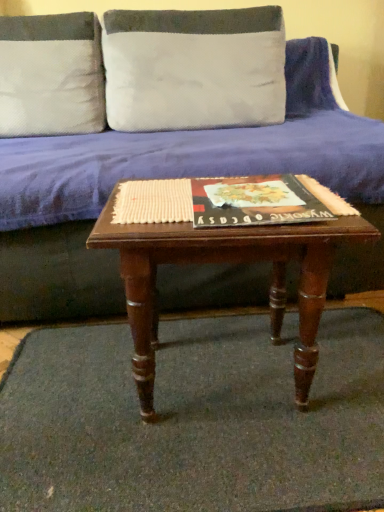
Question: Considering the relative sizes of blue fabric couch at center and mahogany wood coffee table at center in the image provided, is blue fabric couch at center thinner than mahogany wood coffee table at center?

Choices:
 (A) no
 (B) yes

Answer: (A)

Question: Does blue fabric couch at center come behind mahogany wood coffee table at center?

Choices:
 (A) no
 (B) yes

Answer: (B)

Question: Can you confirm if blue fabric couch at center is positioned to the right of mahogany wood coffee table at center?

Choices:
 (A) no
 (B) yes

Answer: (A)

Question: From a real-world perspective, is blue fabric couch at center located higher than mahogany wood coffee table at center?

Choices:
 (A) no
 (B) yes

Answer: (B)

Question: From the image's perspective, is blue fabric couch at center over mahogany wood coffee table at center?

Choices:
 (A) no
 (B) yes

Answer: (B)

Question: Is matte black book at center wider or thinner than mahogany wood coffee table at center?

Choices:
 (A) thin
 (B) wide

Answer: (A)

Question: Is point (236, 201) closer or farther from the camera than point (140, 397)?

Choices:
 (A) closer
 (B) farther

Answer: (A)

Question: From the image's perspective, is matte black book at center positioned above or below mahogany wood coffee table at center?

Choices:
 (A) above
 (B) below

Answer: (A)

Question: Looking at the image, does matte black book at center seem bigger or smaller compared to mahogany wood coffee table at center?

Choices:
 (A) big
 (B) small

Answer: (B)

Question: Considering their positions, is green carpet at center located in front of or behind blue fabric couch at center?

Choices:
 (A) front
 (B) behind

Answer: (A)

Question: Is point (8, 502) closer or farther from the camera than point (344, 266)?

Choices:
 (A) farther
 (B) closer

Answer: (B)

Question: Based on their sizes in the image, would you say green carpet at center is bigger or smaller than blue fabric couch at center?

Choices:
 (A) small
 (B) big

Answer: (A)

Question: Is green carpet at center taller or shorter than blue fabric couch at center?

Choices:
 (A) tall
 (B) short

Answer: (B)

Question: From the image's perspective, relative to mahogany wood coffee table at center, is white textured pillow at upper center, placed as the first pillow when sorted from right to left, above or below?

Choices:
 (A) below
 (B) above

Answer: (B)

Question: Is white textured pillow at upper center, placed as the first pillow when sorted from right to left, in front of or behind mahogany wood coffee table at center in the image?

Choices:
 (A) front
 (B) behind

Answer: (B)